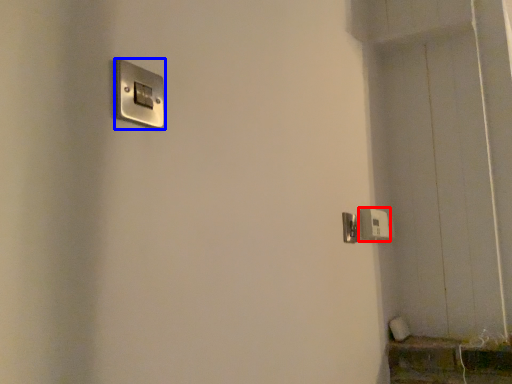
Question: Which object is further to the camera taking this photo, light switch (highlighted by a red box) or light switch (highlighted by a blue box)?

Choices:
 (A) light switch
 (B) light switch

Answer: (A)